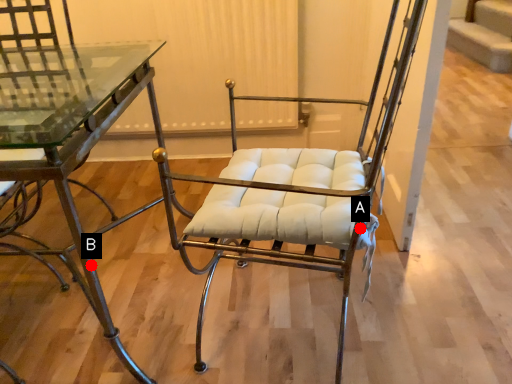
Question: Two points are circled on the image, labeled by A and B beside each circle. Which point is further to the camera?

Choices:
 (A) A is further
 (B) B is further

Answer: (B)